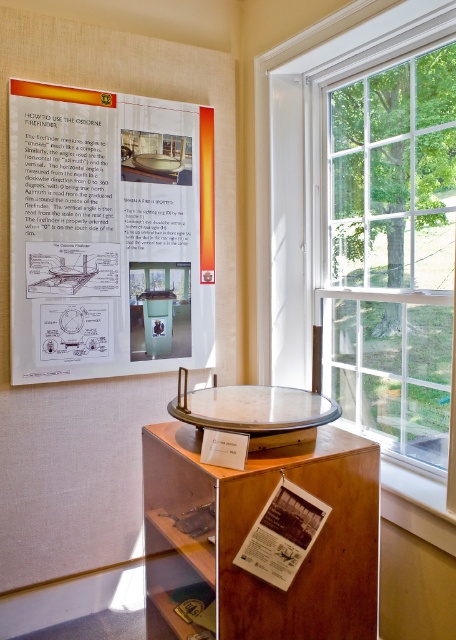
Question: Does clear glass window at right have a smaller size compared to wooden table at center?

Choices:
 (A) yes
 (B) no

Answer: (B)

Question: Which point appears closest to the camera in this image?

Choices:
 (A) (157, 576)
 (B) (404, 122)
 (C) (241, 419)
 (D) (71, 176)

Answer: (C)

Question: Considering the real-world distances, which object is farthest from the metallic polished table at center?

Choices:
 (A) clear glass window at right
 (B) white paper poster at upper left
 (C) white paper at center
 (D) wooden table at center

Answer: (B)

Question: Which is farther from the white paper at center?

Choices:
 (A) wooden table at center
 (B) white paper poster at upper left

Answer: (B)

Question: Can you confirm if clear glass window at right is positioned above white paper at center?

Choices:
 (A) no
 (B) yes

Answer: (B)

Question: Does white paper poster at upper left appear on the left side of wooden table at center?

Choices:
 (A) no
 (B) yes

Answer: (B)